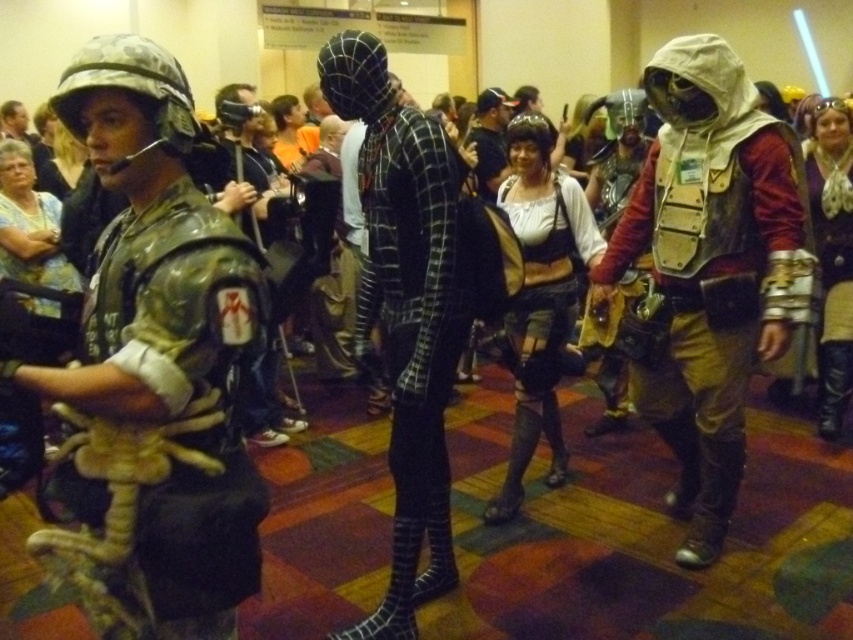
You are a photographer at the event and want to capture a photo where both the metallic armor at left and the leather armor at right are visible. Based on their positions, which armor should be placed closer to the bottom of the frame?

The metallic armor at left should be placed closer to the bottom of the frame because it is positioned below the leather armor at right in the image.

You are standing at the convention and want to take a photo of both the military costume and the dragon costume. The military costume is at point (56, 544) and the dragon costume is at point (737, 476). Which one is closer to you so you can focus your camera first?

The military costume at point (56, 544) is closer to you than the dragon costume at point (737, 476), so you should focus on it first.

You are a photographer at the event and want to capture both the leather armor at right and the black spandex suit at center in a single photo. The camera you are using has a maximum focus range that can only capture objects within 90 centimeters of each other. Can you fit both subjects into the frame without moving either of them?

The leather armor at right and the black spandex suit at center are 86.04 centimeters apart, which is within the camera maximum focus range of 90 centimeters. Therefore, both subjects can be captured in a single photo without moving them.